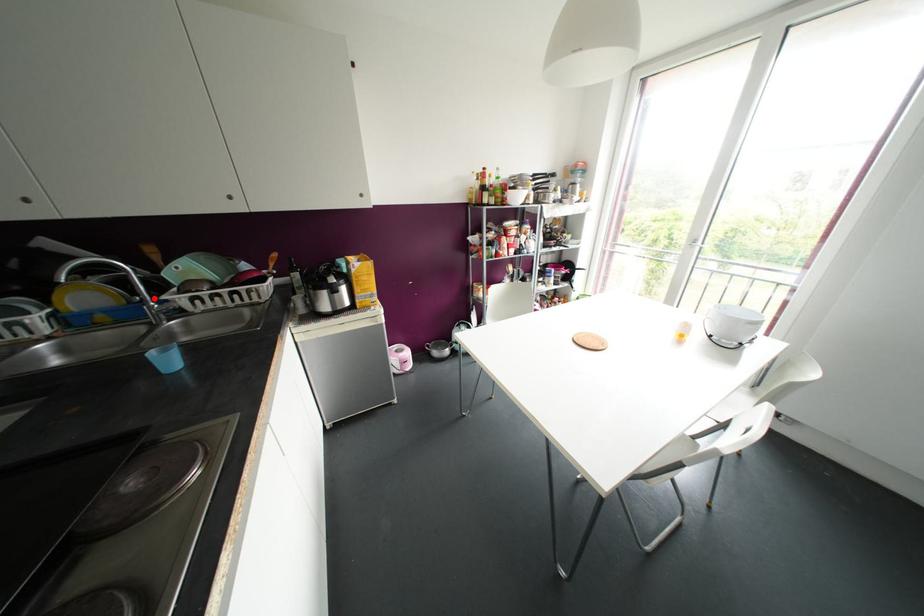
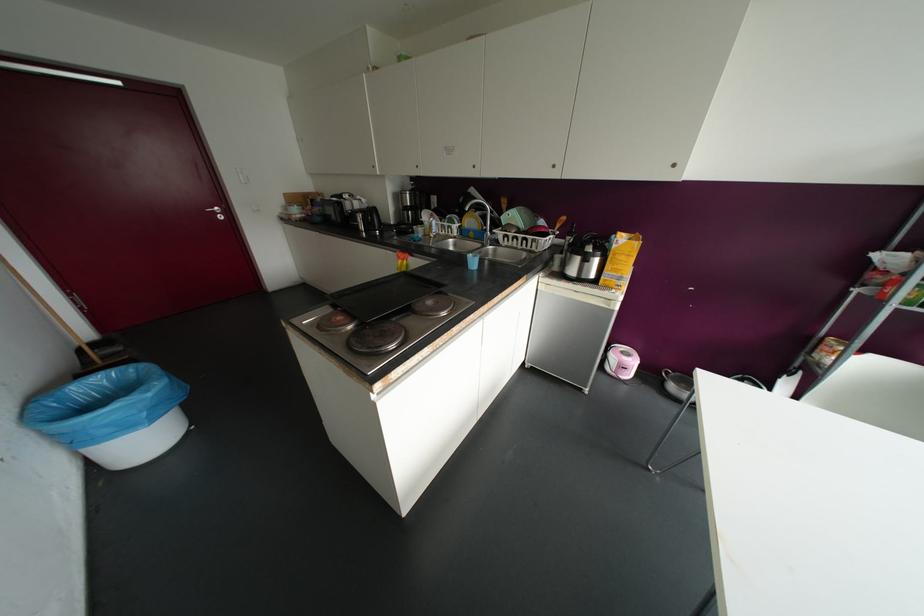
Question: I am providing you with two images of the same scene from different viewpoints. Image1 has a red point marked. In image2, the corresponding 3D location appears at what relative position? Reply with the corresponding letter.

Choices:
 (A) Closer
 (B) Farther

Answer: (A)